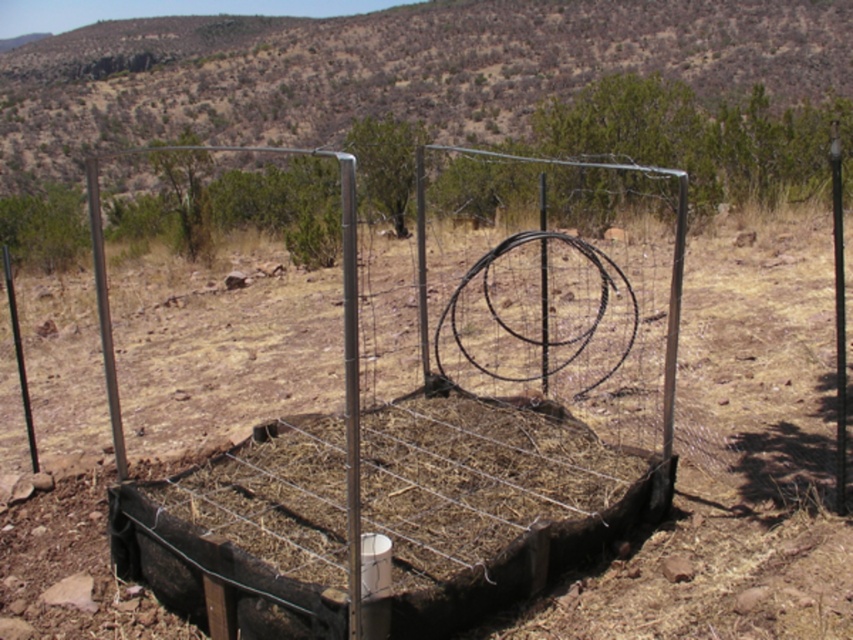
Who is shorter, metal wire fence at center or metallic pole at right?

With less height is metal wire fence at center.

Is point (496, 296) positioned after point (840, 300)?

Yes.

Which is behind, point (604, 273) or point (838, 154)?

Point (838, 154)

The height and width of the screenshot is (640, 853). In order to click on metal wire fence at center in this screenshot , I will do `click(432, 456)`.

Does metal wire fence at center have a larger size compared to metallic pole at left?

Incorrect, metal wire fence at center is not larger than metallic pole at left.

Between point (380, 401) and point (109, 371), which one is positioned in front?

Positioned in front is point (109, 371).

Find the location of a particular element. The width and height of the screenshot is (853, 640). metal wire fence at center is located at coordinates (432, 456).

Can you confirm if metallic pole at right is wider than metallic pole at left?

No.

Which is above, metallic pole at right or metallic pole at left?

metallic pole at left is above.

Find the location of a particular element. metallic pole at right is located at coordinates (838, 314).